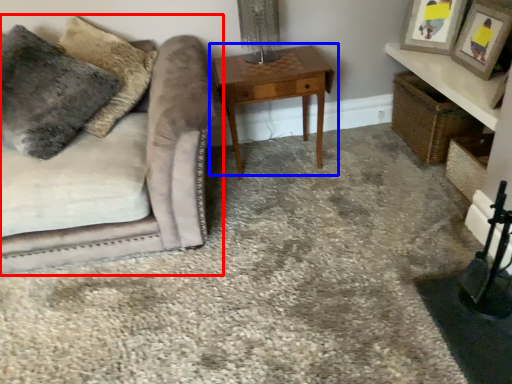
Question: Among these objects, which one is nearest to the camera, studio couch (highlighted by a red box) or table (highlighted by a blue box)?

Choices:
 (A) studio couch
 (B) table

Answer: (A)